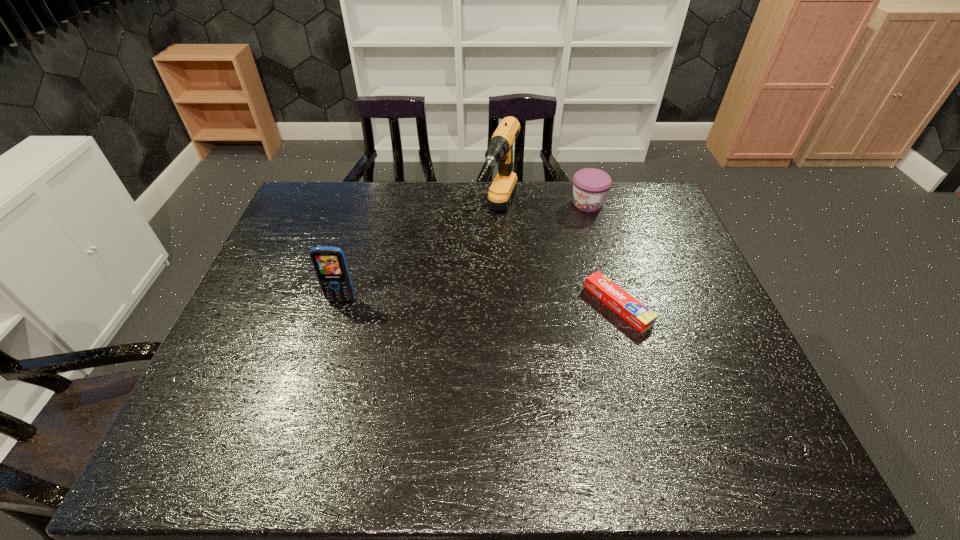
You are a GUI agent. You are given a task and a screenshot of the screen. Output one action in this format:
    pyautogui.click(x=<x>, y=<y>)
    Task: Click on the free space on the desktop that is between the leftmost object and the shortest object and is positioned at the tip of the tallest object
    This screenshot has width=960, height=540.
    Given the screenshot: What is the action you would take?
    pyautogui.click(x=456, y=302)

In order to click on free spot on the desktop that is between the leftmost object and the shortest object and is positioned on the front label of the jam in this screenshot , I will do (479, 302).